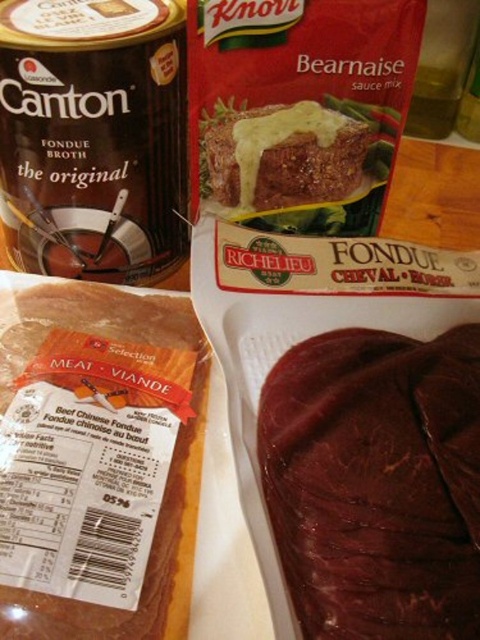
Question: Is brown glossy meat at center closer to camera compared to dark brown glossy meat at lower right?

Choices:
 (A) no
 (B) yes

Answer: (A)

Question: Does brown glossy meat at center appear on the right side of dark brown glossy meat at lower right?

Choices:
 (A) no
 (B) yes

Answer: (A)

Question: Among these points, which one is farthest from the camera?

Choices:
 (A) (128, 630)
 (B) (361, 490)

Answer: (B)

Question: Where is brown glossy meat at center located in relation to dark brown glossy meat at lower right in the image?

Choices:
 (A) above
 (B) below

Answer: (A)

Question: Which point is farther to the camera?

Choices:
 (A) brown glossy meat at center
 (B) dark brown glossy meat at lower right

Answer: (A)